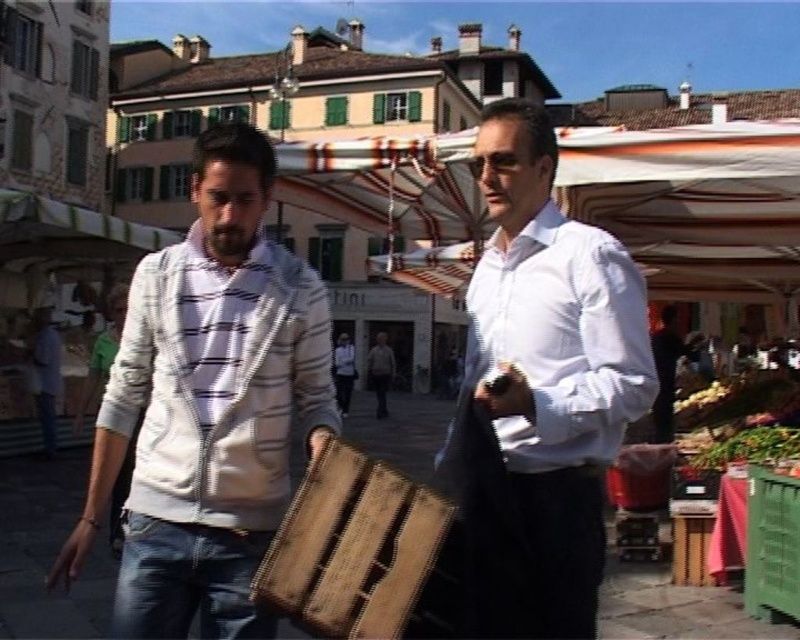
You are a photographer standing at the edge of the market. You want to take a photo that includes both the white matte shirt at center and the green plastic crate at lower right. Based on their positions, which object should you focus on first to ensure both are in the frame?

The white matte shirt at center is located above the green plastic crate at lower right, so you should focus on the white matte shirt at center first to ensure both are in the frame.

You are standing at the entrance of the market and want to find the person wearing the white matte shirt at center. Based on the coordinates provided, in which direction should you look to locate them?

The white matte shirt at center is located at coordinates point (541, 388), so you should look towards the lower right direction from your current position at the entrance.